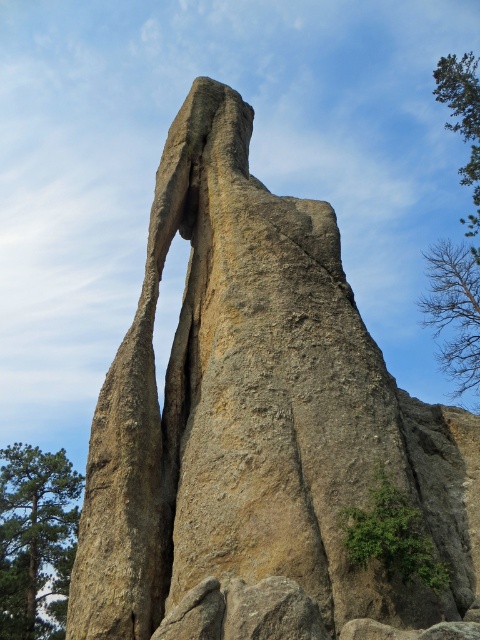
Does green leafy tree at lower right appear over green leafy tree at upper right?

No.

What do you see at coordinates (392, 536) in the screenshot? This screenshot has width=480, height=640. I see `green leafy tree at lower right` at bounding box center [392, 536].

Locate an element on the screen. The width and height of the screenshot is (480, 640). green leafy tree at lower right is located at coordinates [x=392, y=536].

Which of these two, green leafy tree at left or green leafy tree at upper right, stands taller?

green leafy tree at upper right

Who is more distant from viewer, (59, 502) or (447, 88)?

The point (447, 88) is behind.

I want to click on green leafy tree at left, so click(36, 540).

Who is taller, bare branches at upper right or green leafy tree at upper right?

green leafy tree at upper right

Is point (457, 321) more distant than point (468, 173)?

Yes, point (457, 321) is behind point (468, 173).

This screenshot has width=480, height=640. Describe the element at coordinates (455, 310) in the screenshot. I see `bare branches at upper right` at that location.

The height and width of the screenshot is (640, 480). In order to click on bare branches at upper right in this screenshot , I will do `click(455, 310)`.